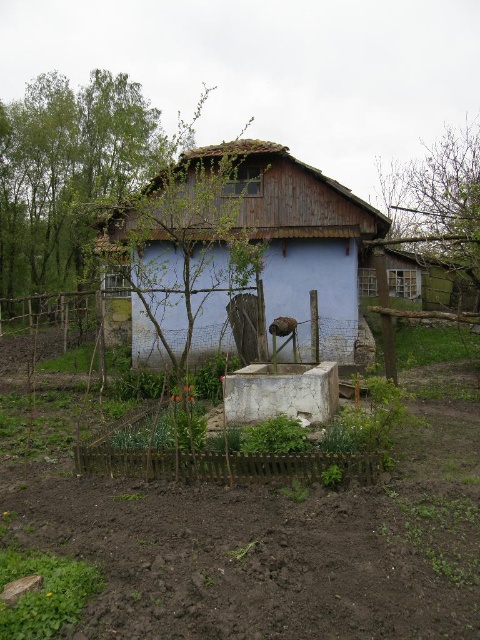
You are standing at the point with coordinates point (106, 547) and want to walk towards the house. Will you pass by point (239, 474) on your way?

Yes, because point (106, 547) is in front of point (239, 474), so walking towards the house from point (106, 547) would pass by point (239, 474).